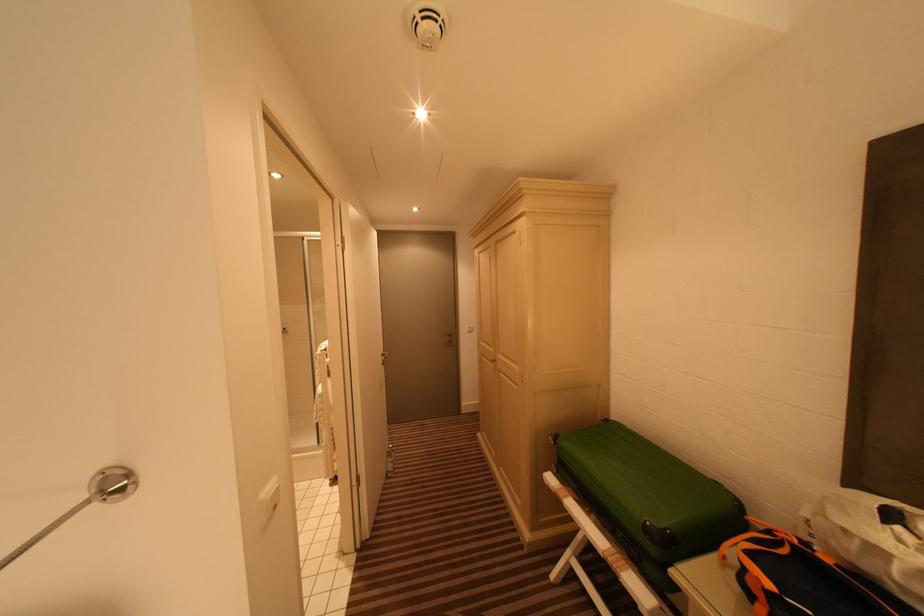
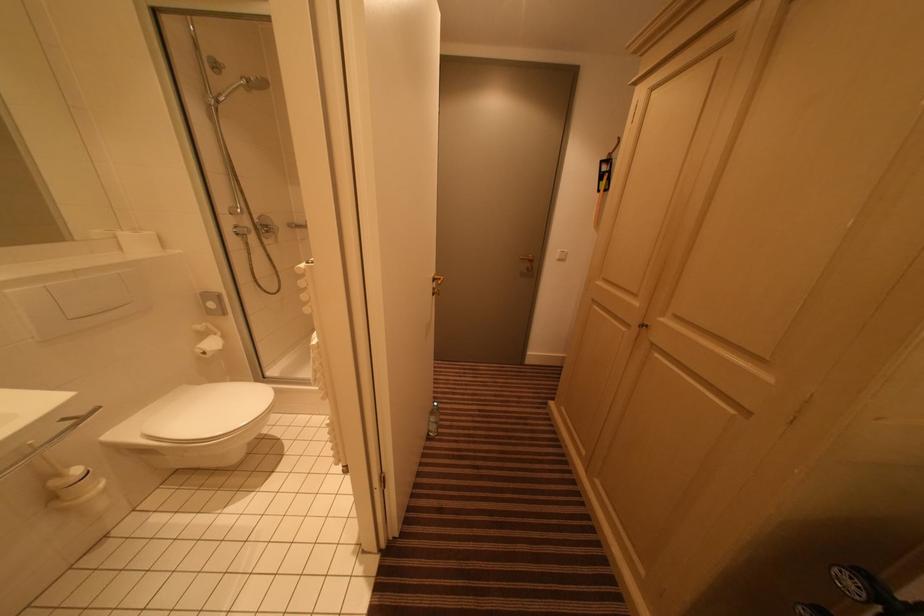
Question: The images are taken continuously from a first-person perspective. In which direction is your viewpoint rotating?

Choices:
 (A) Left
 (B) Right
 (C) Up
 (D) Down

Answer: (D)